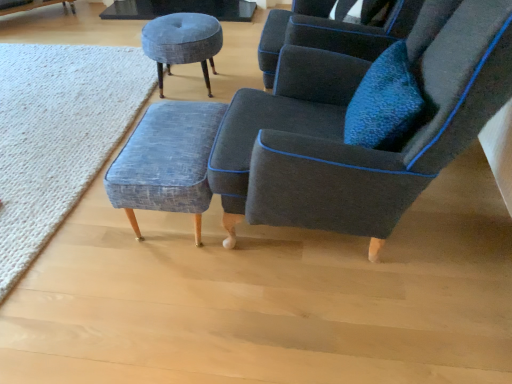
Question: From the image's perspective, is textured blue fabric stool at center, which is the 1th stool in bottom-to-top order, located above or below textured wool rug at lower left?

Choices:
 (A) below
 (B) above

Answer: (A)

Question: Is textured blue fabric stool at center, acting as the first stool starting from the front, inside or outside of textured wool rug at lower left?

Choices:
 (A) inside
 (B) outside

Answer: (B)

Question: Estimate the real-world distances between objects in this image. Which object is closer to the textured blue fabric stool at center, acting as the first stool starting from the front?

Choices:
 (A) textured gray stool at upper center, positioned as the first stool in top-to-bottom order
 (B) textured wool rug at lower left
 (C) dark gray fabric chair at center

Answer: (C)

Question: Which object is the farthest from the textured wool rug at lower left?

Choices:
 (A) textured blue fabric stool at center, which is the 1th stool in bottom-to-top order
 (B) dark gray fabric chair at center
 (C) textured gray stool at upper center, which appears as the 1th stool when viewed from the back

Answer: (B)